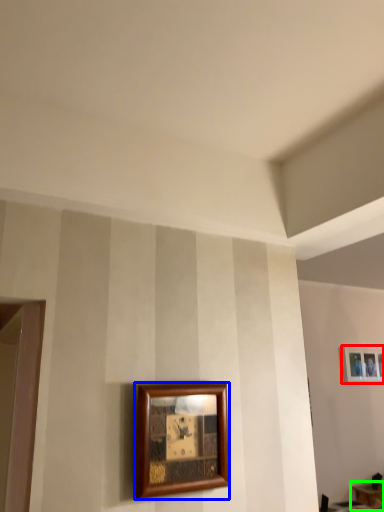
Question: Considering the real-world distances, which object is farthest from picture frame (highlighted by a red box)? picture frame (highlighted by a blue box) or table (highlighted by a green box)?

Choices:
 (A) picture frame
 (B) table

Answer: (A)